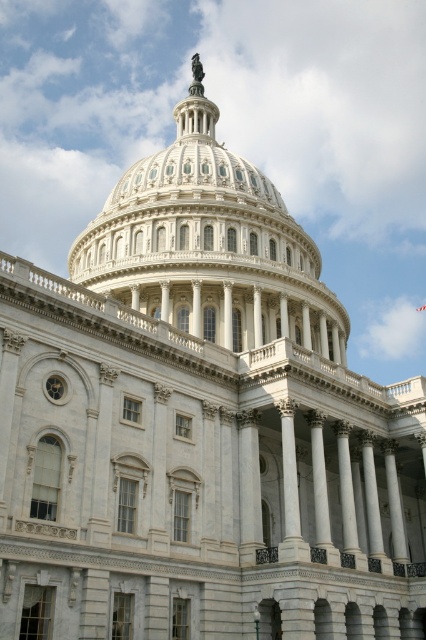
You are an architect analyzing the United States Capitol building. You need to determine which of the two white marble structures at the center has a greater width between the white marble dome at center and the white marble column at center. Which one is wider?

The white marble dome at center is wider than the white marble column at center.

You are a tourist visiting the United States Capitol building and want to take a photo that includes both the white marble dome at center and the white marble column at center. Which object should you focus on first to ensure both fit in the frame?

The white marble dome at center is bigger than the white marble column at center, so you should focus on the white marble dome at center first to ensure both fit in the frame since it requires more space.